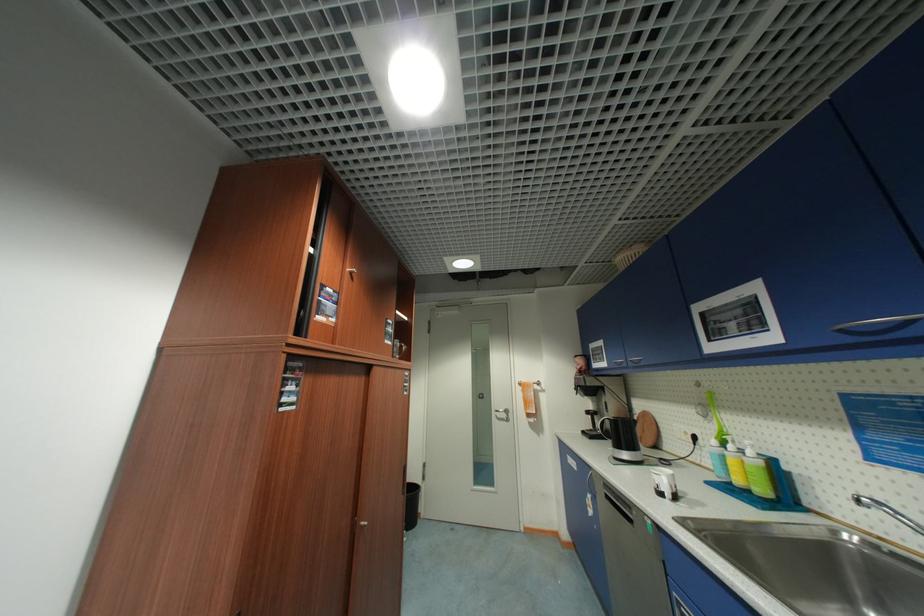
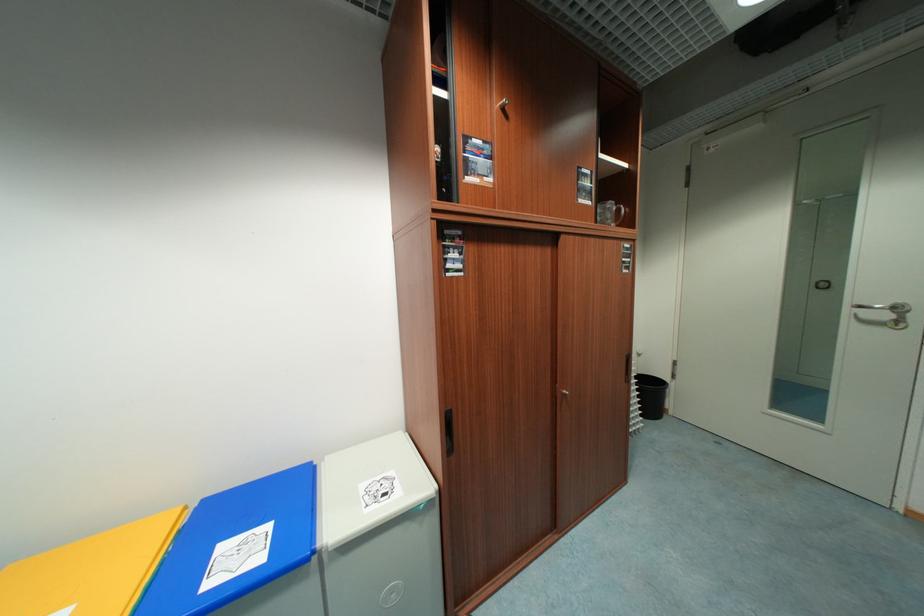
Where in the second image is the point corresponding to (407,347) from the first image?

(624, 211)